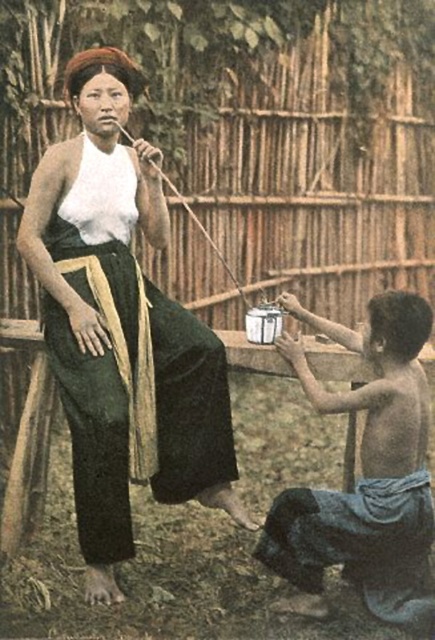
You are a photographer trying to capture a photo of the matte white blouse at upper left and the smooth wooden pot at lower right. Which object should you focus on first if you want to ensure both are in sharp focus, considering their heights?

The matte white blouse at upper left is taller than the smooth wooden pot at lower right. To ensure both are in sharp focus, focus on the matte white blouse at upper left first, as it is the taller object and will require adjusting the depth of field accordingly.

You are a photographer trying to capture a candid shot of the matte white blouse at upper left without the smooth wooden pot at lower right appearing in the frame. Based on their positions, is this possible?

The smooth wooden pot at lower right is behind the matte white blouse at upper left, so it should not block the view. Therefore, it is possible to take a photo of the matte white blouse at upper left without the smooth wooden pot at lower right appearing in the frame.